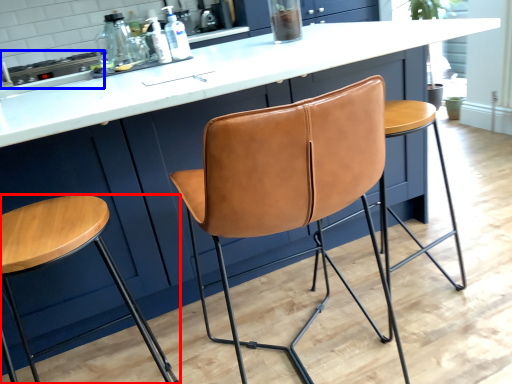
Question: Which object appears closest to the camera in this image, stool (highlighted by a red box) or appliance (highlighted by a blue box)?

Choices:
 (A) stool
 (B) appliance

Answer: (A)